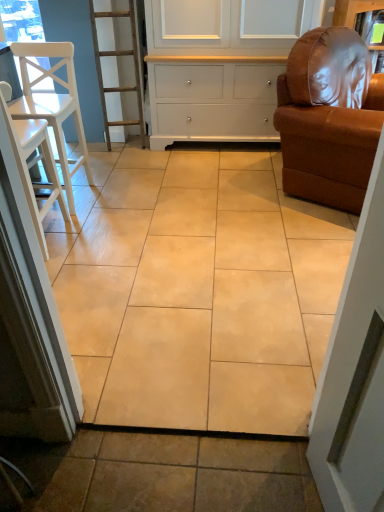
This screenshot has width=384, height=512. I want to click on free space in front of white painted wood cabinet at upper center, so click(220, 178).